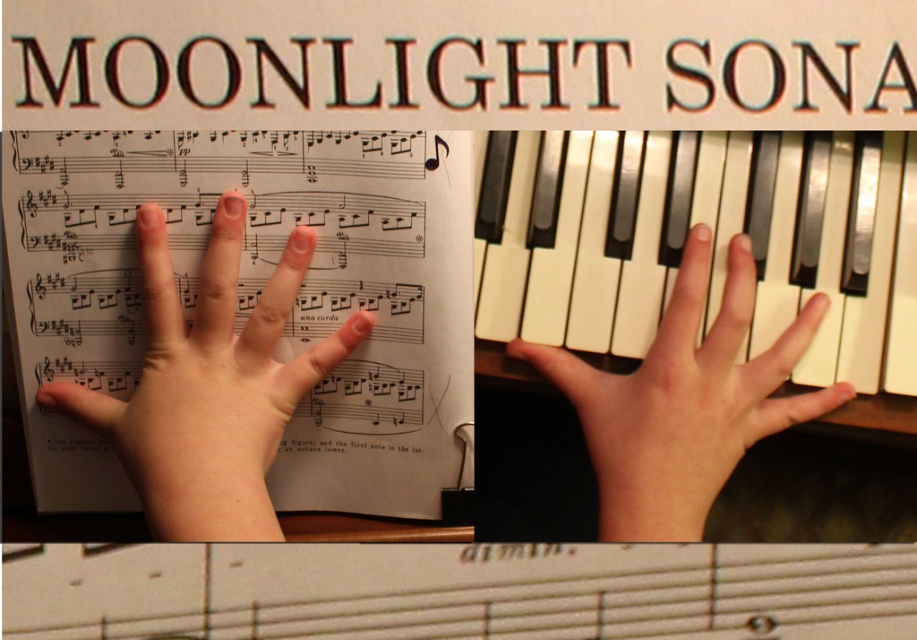
Question: Is white glossy piano keys at center bigger than smooth skin hand at upper center?

Choices:
 (A) no
 (B) yes

Answer: (A)

Question: Which of these objects is positioned closest to the smooth skin hand at upper center?

Choices:
 (A) pale skin hand at upper left
 (B) white glossy piano keys at center

Answer: (B)

Question: Is white glossy piano keys at center bigger than smooth skin hand at upper center?

Choices:
 (A) no
 (B) yes

Answer: (A)

Question: Which of these objects is positioned closest to the smooth skin hand at upper center?

Choices:
 (A) white glossy piano keys at center
 (B) pale skin hand at upper left

Answer: (A)

Question: Which point is farther to the camera?

Choices:
 (A) smooth skin hand at upper center
 (B) pale skin hand at upper left

Answer: (A)

Question: Is pale skin hand at upper left wider than smooth skin hand at upper center?

Choices:
 (A) no
 (B) yes

Answer: (A)